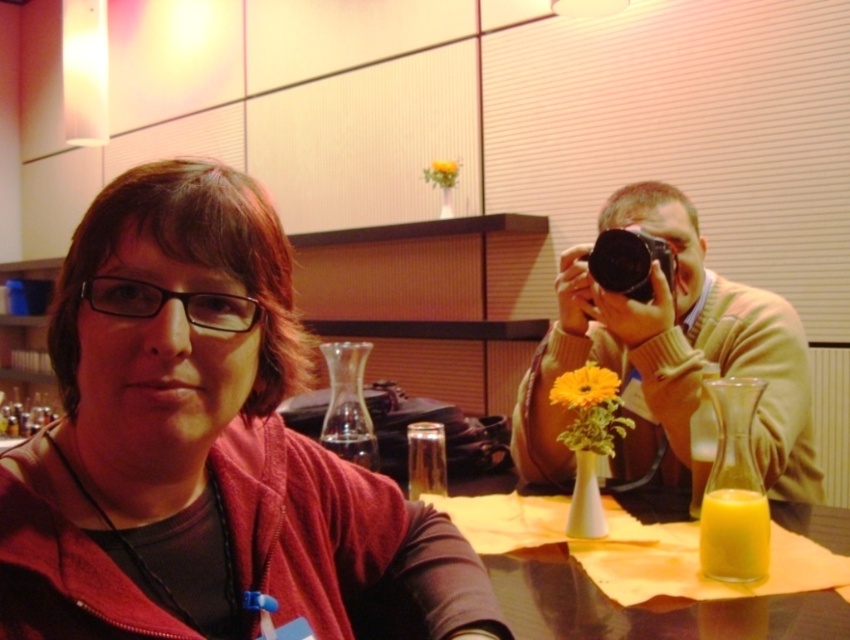
Is matte beige sweater at right thinner than translucent glass cup at lower right?

In fact, matte beige sweater at right might be wider than translucent glass cup at lower right.

Does point (766, 323) come farther from viewer compared to point (706, 563)?

Yes, point (766, 323) is behind point (706, 563).

I want to click on matte beige sweater at right, so click(x=669, y=358).

Image resolution: width=850 pixels, height=640 pixels. I want to click on matte beige sweater at right, so click(669, 358).

Which is below, black plastic glasses at center or orange matte flower at center?

orange matte flower at center is below.

Locate an element on the screen. black plastic glasses at center is located at coordinates (167, 300).

Between yellow glass at center and orange matte flower at center, which one has more height?

orange matte flower at center is taller.

Can you confirm if yellow glass at center is positioned to the right of orange matte flower at center?

Correct, you'll find yellow glass at center to the right of orange matte flower at center.

Between point (576, 600) and point (595, 394), which one is positioned behind?

The point (595, 394) is behind.

Find the location of `yellow glass at center`. yellow glass at center is located at coordinates (644, 605).